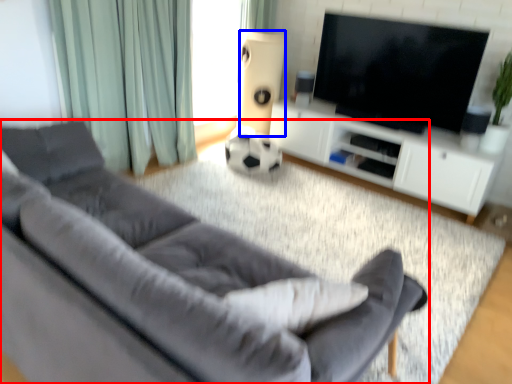
Question: Which of the following is the closest to the observer, studio couch (highlighted by a red box) or speaker (highlighted by a blue box)?

Choices:
 (A) studio couch
 (B) speaker

Answer: (A)